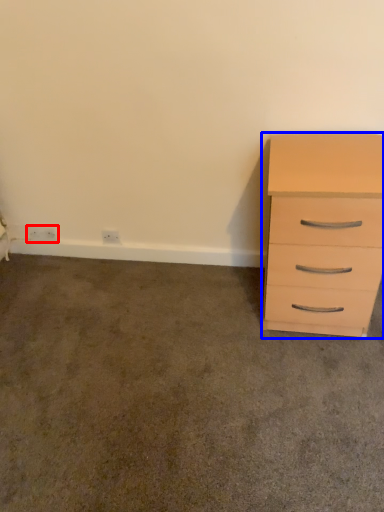
Question: Which object is further to the camera taking this photo, electric outlet (highlighted by a red box) or chest of drawers (highlighted by a blue box)?

Choices:
 (A) electric outlet
 (B) chest of drawers

Answer: (A)